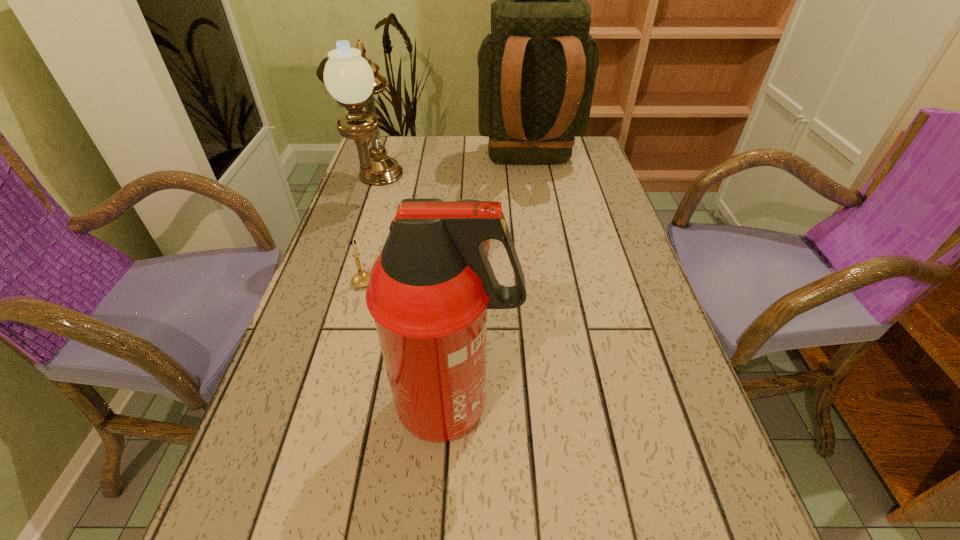
At what (x,y) coordinates should I click in order to perform the action: click on object that is at the far right corner. Please return your answer as a coordinate pair (x, y). This screenshot has height=540, width=960. Looking at the image, I should click on (537, 69).

The height and width of the screenshot is (540, 960). I want to click on vacant space at the far edge, so click(427, 153).

Identify the location of vacant space at the left edge of the desktop. This screenshot has width=960, height=540. (339, 494).

You are a GUI agent. You are given a task and a screenshot of the screen. Output one action in this format:
    pyautogui.click(x=<x>, y=<y>)
    Task: Click on the free spot at the right edge of the desktop
    
    Given the screenshot: What is the action you would take?
    pyautogui.click(x=592, y=180)

The width and height of the screenshot is (960, 540). In order to click on free location at the far right corner in this screenshot , I will do `click(591, 150)`.

Find the location of a particular element. This screenshot has height=540, width=960. unoccupied area between the backpack and the oil lamp is located at coordinates (453, 175).

Identify which object is the nearest to the mug. Please provide its 2D coordinates. Your answer should be formatted as a tuple, i.e. [(x, y)], where the tuple contains the x and y coordinates of a point satisfying the conditions above.

[(361, 279)]

Identify which object is located as the fourth nearest to the backpack. Please provide its 2D coordinates. Your answer should be formatted as a tuple, i.e. [(x, y)], where the tuple contains the x and y coordinates of a point satisfying the conditions above.

[(430, 287)]

At what (x,y) coordinates should I click in order to perform the action: click on vacant position in the image that satisfies the following two spatial constraints: 1. on the back of the backpack; 2. on the trigger side of the fire extinguisher. Please return your answer as a coordinate pair (x, y). Looking at the image, I should click on (568, 407).

Find the location of a particular element. The height and width of the screenshot is (540, 960). vacant position in the image that satisfies the following two spatial constraints: 1. on the back of the backpack; 2. on the trigger side of the nearest object is located at coordinates (568, 407).